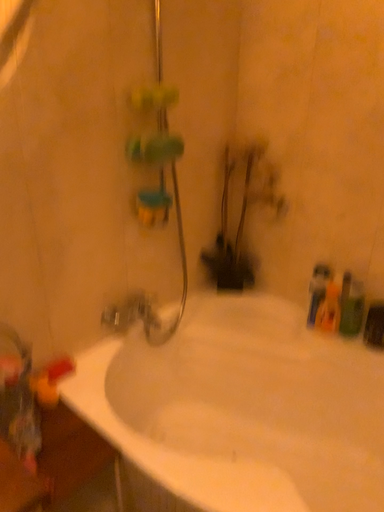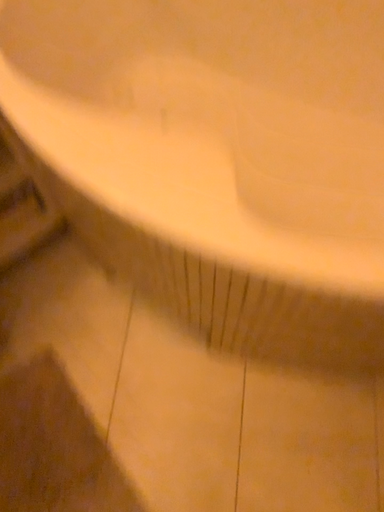
Question: Which way did the camera rotate in the video?

Choices:
 (A) rotated downward
 (B) rotated upward

Answer: (A)